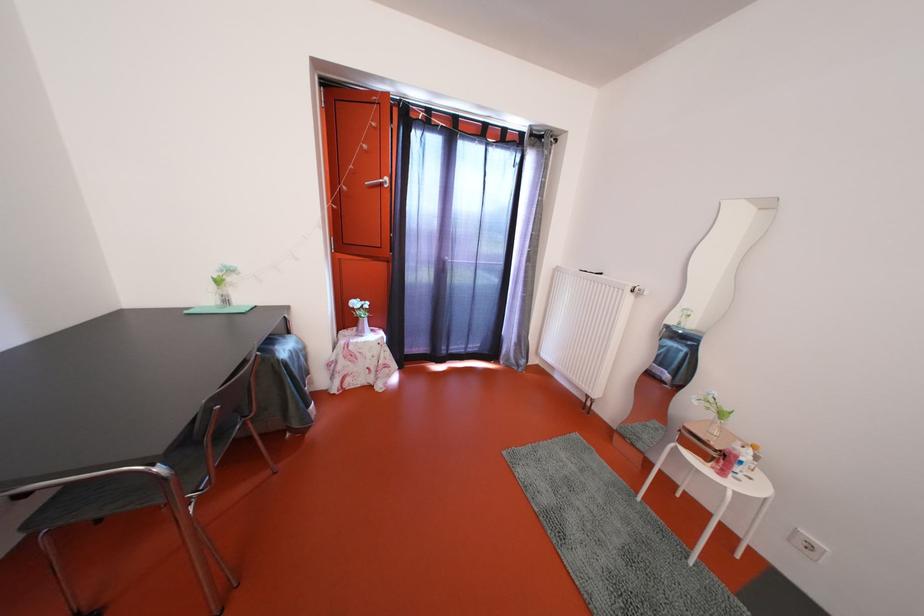
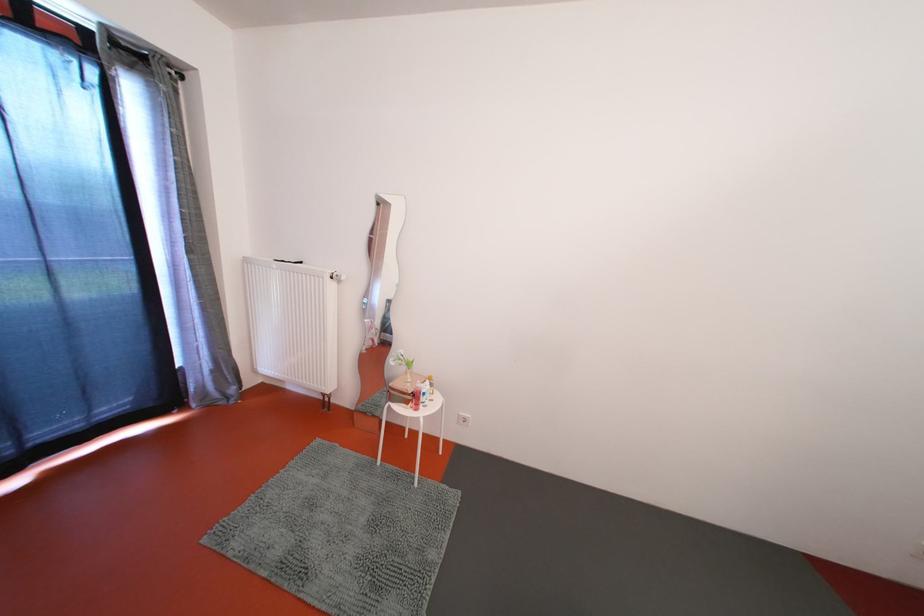
In the second image, find the point that corresponds to point (748, 456) in the first image.

(429, 391)